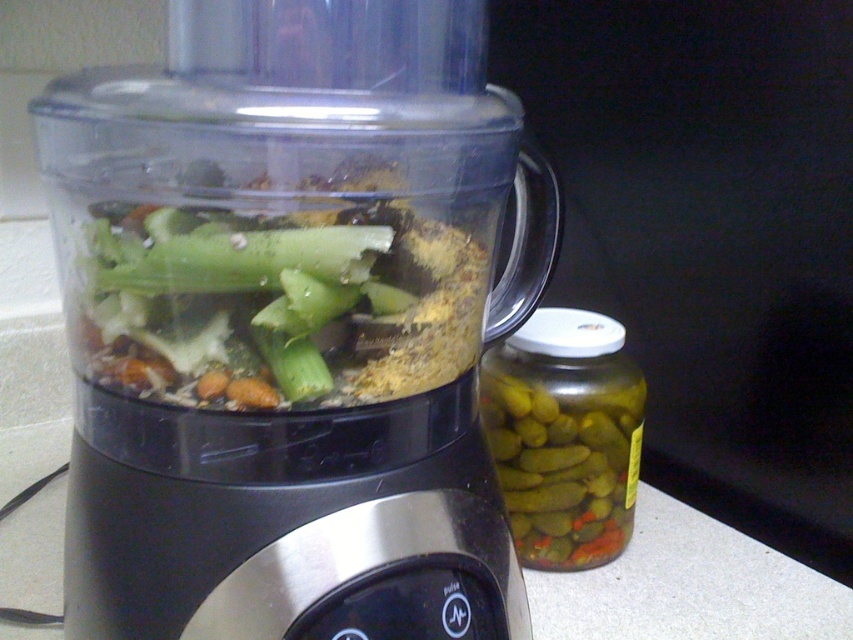
What are the coordinates of the green matte vegetable at center?

The green matte vegetable at center is located at point (x=281, y=301).

You are standing in front of the kitchen countertop scene. You need to place a small bowl between the two points marked as point [450,364] and point [573,317]. Can you determine which point is closer to you so you can place the bowl appropriately?

Point [450,364] is in front of point [573,317], so you should place the bowl closer to point [450,364].

You are a chef preparing a dish and need to know if the transparent plastic food processor at center can fully contain the green matte vegetable at center vertically. Based on their heights, can it?

The transparent plastic food processor at center has a greater height compared to green matte vegetable at center, so yes, it can fully contain the green matte vegetable at center vertically.